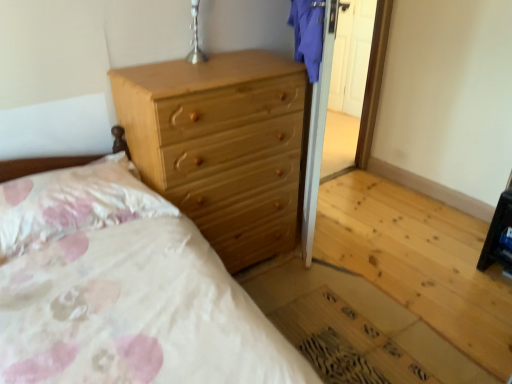
Question: Considering the relative sizes of fluffy white pillow at upper left and natural wood chest of drawers at upper center in the image provided, is fluffy white pillow at upper left bigger than natural wood chest of drawers at upper center?

Choices:
 (A) yes
 (B) no

Answer: (B)

Question: Is there a large distance between fluffy white pillow at upper left and natural wood chest of drawers at upper center?

Choices:
 (A) yes
 (B) no

Answer: (B)

Question: Is fluffy white pillow at upper left with natural wood chest of drawers at upper center?

Choices:
 (A) yes
 (B) no

Answer: (B)

Question: From the image's perspective, does fluffy white pillow at upper left appear lower than natural wood chest of drawers at upper center?

Choices:
 (A) no
 (B) yes

Answer: (B)

Question: Is fluffy white pillow at upper left wider than natural wood chest of drawers at upper center?

Choices:
 (A) no
 (B) yes

Answer: (A)

Question: Looking at their shapes, would you say fluffy white pillow at upper left is wider or thinner than silver metallic table lamp at upper center?

Choices:
 (A) wide
 (B) thin

Answer: (A)

Question: From their relative heights in the image, would you say fluffy white pillow at upper left is taller or shorter than silver metallic table lamp at upper center?

Choices:
 (A) short
 (B) tall

Answer: (A)

Question: Considering their positions, is fluffy white pillow at upper left located in front of or behind silver metallic table lamp at upper center?

Choices:
 (A) front
 (B) behind

Answer: (A)

Question: Considering the positions of point (82, 203) and point (196, 46), is point (82, 203) closer or farther from the camera than point (196, 46)?

Choices:
 (A) farther
 (B) closer

Answer: (B)

Question: Considering the relative positions of silver metallic table lamp at upper center and fluffy white pillow at upper left in the image provided, is silver metallic table lamp at upper center to the left or to the right of fluffy white pillow at upper left?

Choices:
 (A) left
 (B) right

Answer: (B)

Question: From their relative heights in the image, would you say silver metallic table lamp at upper center is taller or shorter than fluffy white pillow at upper left?

Choices:
 (A) tall
 (B) short

Answer: (A)

Question: In terms of size, does silver metallic table lamp at upper center appear bigger or smaller than fluffy white pillow at upper left?

Choices:
 (A) big
 (B) small

Answer: (B)

Question: Choose the correct answer: Is silver metallic table lamp at upper center inside fluffy white pillow at upper left or outside it?

Choices:
 (A) outside
 (B) inside

Answer: (A)

Question: From the image's perspective, is natural wood chest of drawers at upper center positioned above or below silver metallic table lamp at upper center?

Choices:
 (A) below
 (B) above

Answer: (A)

Question: Considering the positions of point click(x=278, y=81) and point click(x=196, y=19), is point click(x=278, y=81) closer or farther from the camera than point click(x=196, y=19)?

Choices:
 (A) closer
 (B) farther

Answer: (A)